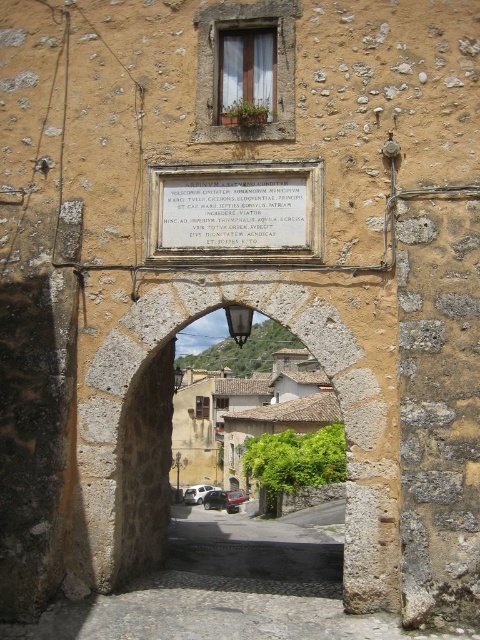
Based on the photo, does brown stone houses at center appear over white fabric window at upper center?

No, brown stone houses at center is not above white fabric window at upper center.

Is point (223, 376) positioned in front of point (239, 54)?

No, (223, 376) is behind (239, 54).

At what (x,y) coordinates should I click in order to perform the action: click on brown stone houses at center. Please return your answer as a coordinate pair (x, y). This screenshot has height=640, width=480. Looking at the image, I should click on (244, 413).

Who is positioned more to the right, brown stone houses at center or white matte car at center?

From the viewer's perspective, brown stone houses at center appears more on the right side.

Does brown stone houses at center come behind white matte car at center?

No, it is not.

Is point (300, 416) farther from viewer compared to point (196, 499)?

That is False.

Locate an element on the screen. brown stone houses at center is located at coordinates (244, 413).

Is white fabric window at upper center thinner than white matte car at center?

Yes, white fabric window at upper center is thinner than white matte car at center.

Between white fabric window at upper center and white matte car at center, which one has more height?

Standing taller between the two is white fabric window at upper center.

Who is more distant from viewer, (269, 74) or (207, 486)?

The point (207, 486) is behind.

Where is `white fabric window at upper center`? white fabric window at upper center is located at coordinates (247, 72).